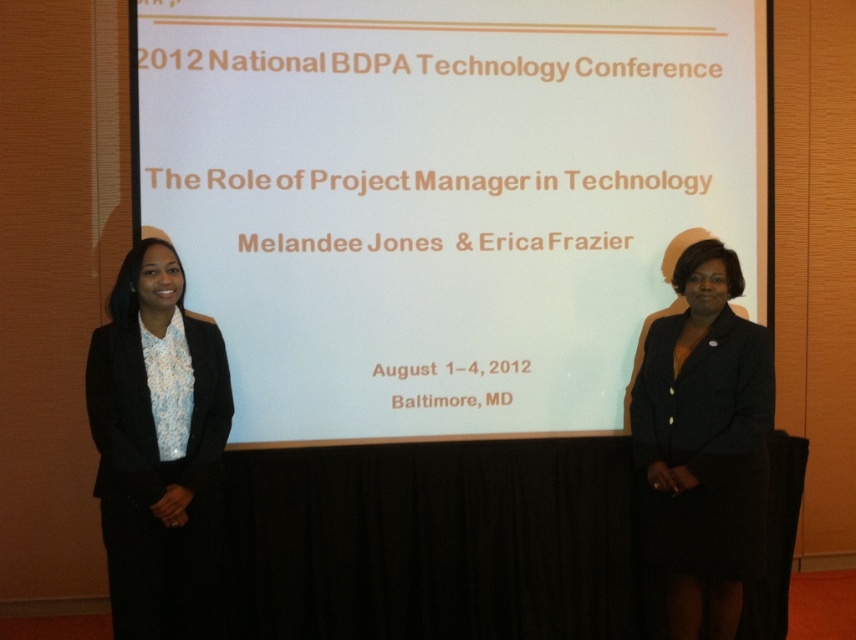
Does point (177, 536) come closer to viewer compared to point (712, 276)?

That is True.

Which is behind, point (123, 356) or point (688, 545)?

Positioned behind is point (688, 545).

Is point (113, 448) positioned in front of point (704, 381)?

Yes, it is.

In order to click on black satin blazer at left in this screenshot , I will do `click(158, 449)`.

Based on the photo, who is taller, white matte projection screen at center or black satin blazer at left?

With more height is white matte projection screen at center.

Does point (330, 186) come behind point (116, 280)?

That is False.

Is point (536, 316) more distant than point (159, 420)?

That is True.

Locate an element on the screen. white matte projection screen at center is located at coordinates (446, 198).

Does white matte projection screen at center have a smaller size compared to black fabric skirt at right?

Actually, white matte projection screen at center might be larger than black fabric skirt at right.

Does white matte projection screen at center have a greater height compared to black fabric skirt at right?

Indeed, white matte projection screen at center has a greater height compared to black fabric skirt at right.

Describe the element at coordinates (446, 198) in the screenshot. I see `white matte projection screen at center` at that location.

The image size is (856, 640). I want to click on white matte projection screen at center, so click(446, 198).